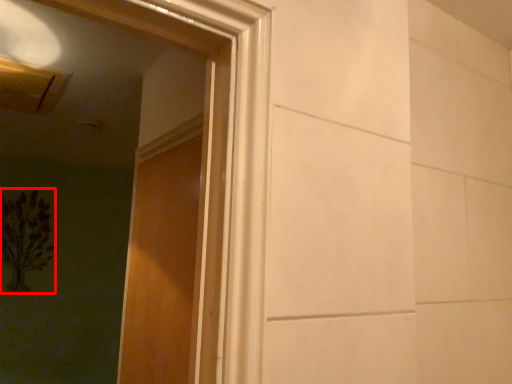
Question: Where is flower (annotated by the red box) located in relation to door in the image?

Choices:
 (A) left
 (B) right

Answer: (A)